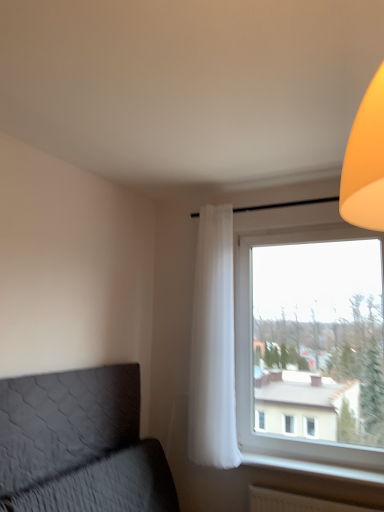
Question: Is white plastic radiator at lower right taller than dark gray quilted headboard at lower left?

Choices:
 (A) yes
 (B) no

Answer: (B)

Question: Can you confirm if white plastic radiator at lower right is thinner than dark gray quilted headboard at lower left?

Choices:
 (A) no
 (B) yes

Answer: (A)

Question: From the image's perspective, would you say white plastic radiator at lower right is positioned over dark gray quilted headboard at lower left?

Choices:
 (A) no
 (B) yes

Answer: (A)

Question: Is white plastic radiator at lower right closer to camera compared to dark gray quilted headboard at lower left?

Choices:
 (A) yes
 (B) no

Answer: (B)

Question: Is white plastic radiator at lower right aimed at dark gray quilted headboard at lower left?

Choices:
 (A) no
 (B) yes

Answer: (A)

Question: From a real-world perspective, is white sheer curtain at center positioned above or below dark gray quilted headboard at lower left?

Choices:
 (A) above
 (B) below

Answer: (A)

Question: In terms of width, does white sheer curtain at center look wider or thinner when compared to dark gray quilted headboard at lower left?

Choices:
 (A) thin
 (B) wide

Answer: (B)

Question: Does point (210, 236) appear closer or farther from the camera than point (117, 397)?

Choices:
 (A) farther
 (B) closer

Answer: (A)

Question: Choose the correct answer: Is white sheer curtain at center inside dark gray quilted headboard at lower left or outside it?

Choices:
 (A) inside
 (B) outside

Answer: (B)

Question: Is transparent glass window at right to the left or to the right of white sheer curtain at center in the image?

Choices:
 (A) right
 (B) left

Answer: (A)

Question: Is transparent glass window at right wider or thinner than white sheer curtain at center?

Choices:
 (A) thin
 (B) wide

Answer: (A)

Question: Is point pos(319,245) positioned closer to the camera than point pos(193,389)?

Choices:
 (A) farther
 (B) closer

Answer: (A)

Question: Looking at the image, does transparent glass window at right seem bigger or smaller compared to white sheer curtain at center?

Choices:
 (A) big
 (B) small

Answer: (A)

Question: Considering the positions of transparent glass window at right and white plastic radiator at lower right in the image, is transparent glass window at right bigger or smaller than white plastic radiator at lower right?

Choices:
 (A) big
 (B) small

Answer: (A)

Question: Does point (279, 337) appear closer or farther from the camera than point (359, 471)?

Choices:
 (A) closer
 (B) farther

Answer: (B)